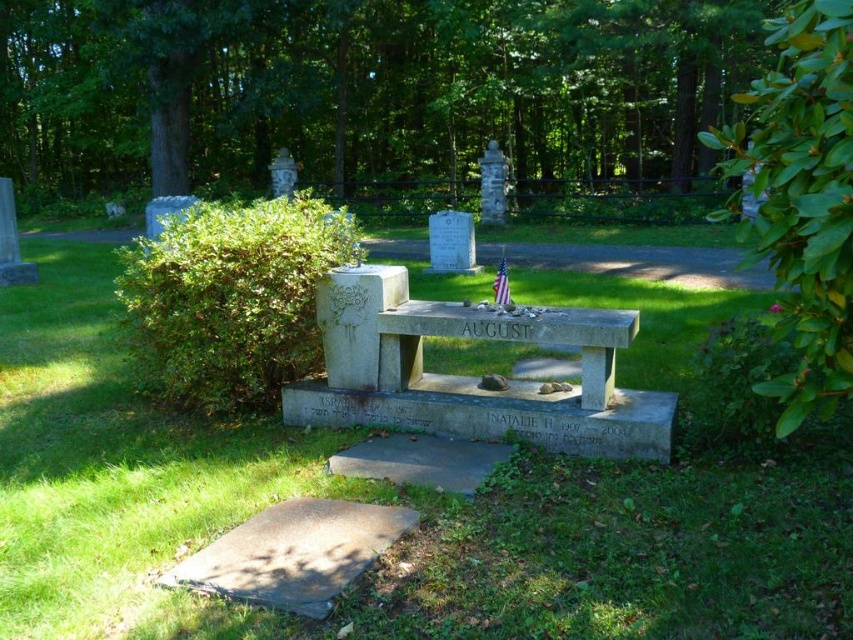
Describe the element at coordinates (375, 100) in the screenshot. I see `green leafy bush at center` at that location.

Who is shorter, green leafy bush at center or green leafy bush at right?

green leafy bush at right

This screenshot has height=640, width=853. What do you see at coordinates (375, 100) in the screenshot?
I see `green leafy bush at center` at bounding box center [375, 100].

Locate an element on the screen. This screenshot has width=853, height=640. green leafy bush at center is located at coordinates (375, 100).

Is green leafy bush at center wider than green leafy bush at left?

Yes, green leafy bush at center is wider than green leafy bush at left.

Can you confirm if green leafy bush at center is positioned to the right of green leafy bush at left?

Incorrect, green leafy bush at center is not on the right side of green leafy bush at left.

Is point (612, 29) less distant than point (247, 387)?

No, it is not.

At what (x,y) coordinates should I click in order to perform the action: click on green leafy bush at center. Please return your answer as a coordinate pair (x, y). Looking at the image, I should click on (375, 100).

Is point (190, 72) farther from camera compared to point (544, 317)?

Yes, point (190, 72) is farther from viewer.

Between green leafy bush at center and smooth gray stone bench at center, which one has less height?

Standing shorter between the two is smooth gray stone bench at center.

Between point (605, 196) and point (590, 404), which one is positioned in front?

Point (590, 404) is more forward.

I want to click on green leafy bush at center, so click(x=375, y=100).